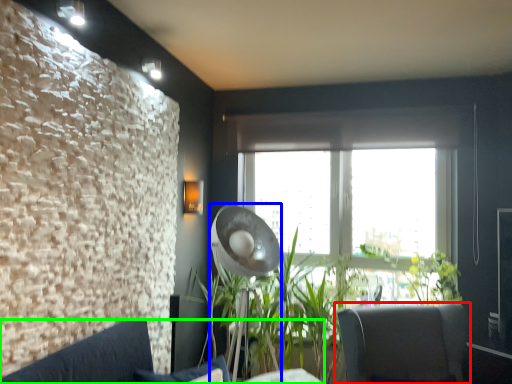
Question: Which object is positioned farthest from chair (highlighted by a red box)? Select from lamp (highlighted by a blue box) and studio couch (highlighted by a green box).

Choices:
 (A) lamp
 (B) studio couch

Answer: (B)